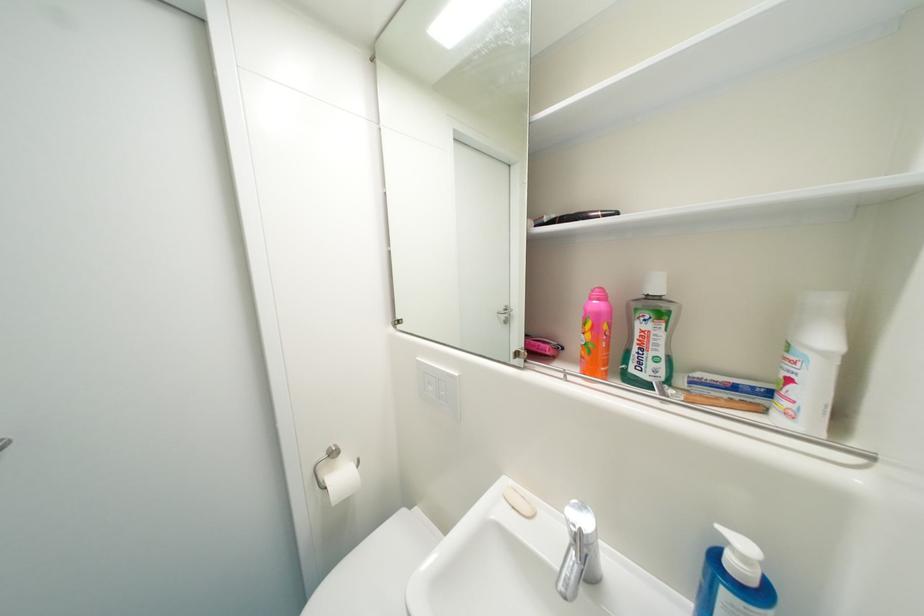
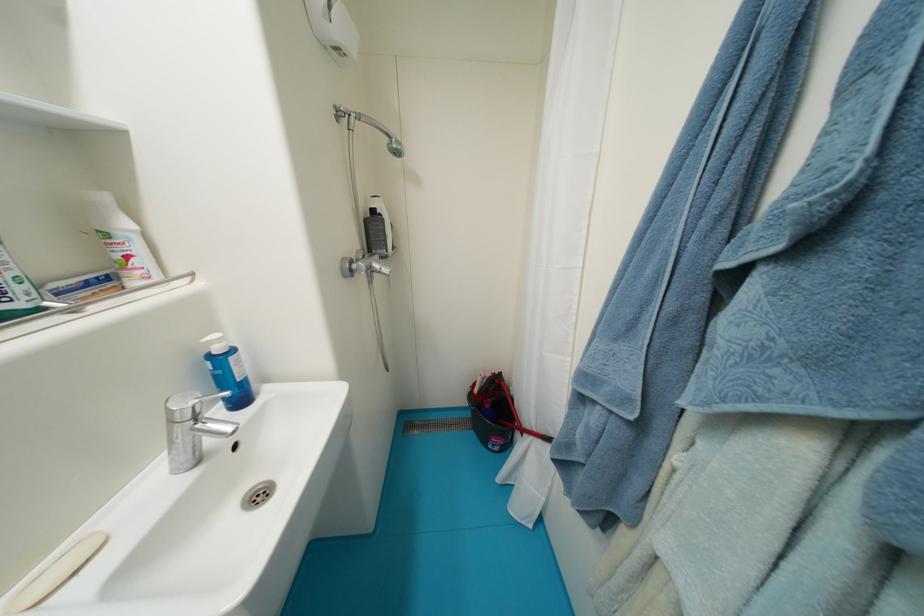
In the second image, find the point that corresponds to (x=704, y=377) in the first image.

(61, 286)